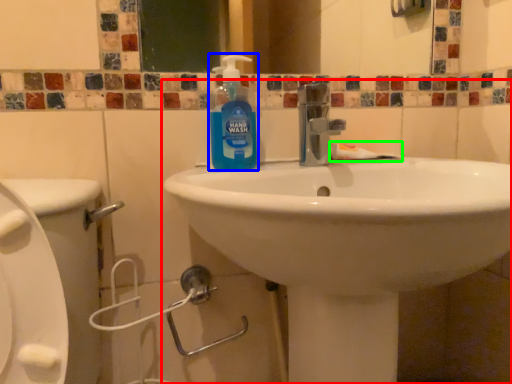
Question: Which object is positioned farthest from sink (highlighted by a red box)? Select from cleaning product (highlighted by a blue box) and toothpaste (highlighted by a green box).

Choices:
 (A) cleaning product
 (B) toothpaste

Answer: (B)